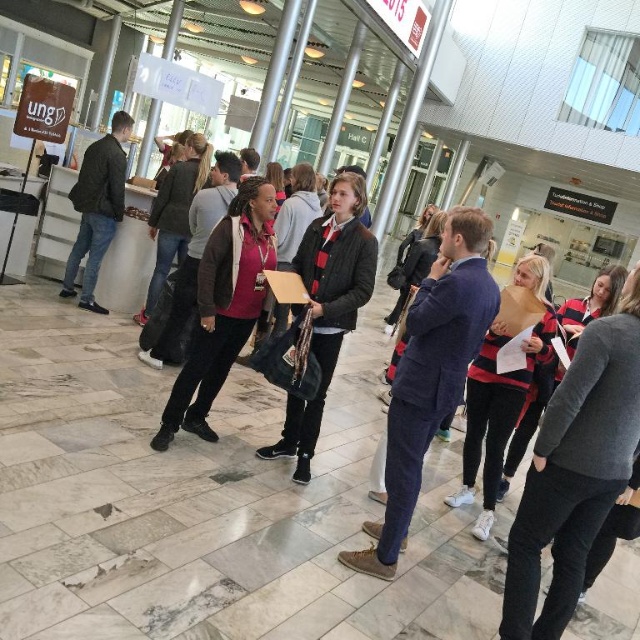
You are a photographer standing at the back of the room. You want to take a photo that includes both the matte black jacket at center and the dark gray jacket at left. The camera you are using has a maximum focus range of 3 meters. Will you be able to capture both jackets in the same frame without moving closer?

The distance between the matte black jacket at center and the dark gray jacket at left is 3.01 meters. Since the camera can only focus up to 3 meters, the jackets are just slightly beyond the focus range. Therefore, you won the be able to capture both jackets in the same frame without moving closer.

You are organizing a photo shoot in this conference space and need to position two models wearing the matte black jacket at center and the dark gray jacket at left. Since space is limited, you want to know which jacket takes up more room. Which jacket should you choose if you want to minimize the space taken?

The matte black jacket at center occupies less space than the dark gray jacket at left, so you should choose the matte black jacket at center to minimize the space taken.

You are an event planner arranging seating for a panel discussion. You need to ensure that the matte black jacket at center and the dark gray jacket at left are visible to all attendees. Considering their heights, which jacket might block the view of the other if placed directly in front?

The matte black jacket at center is taller than the dark gray jacket at left, so placing it directly in front could block the view of the dark gray jacket at left.